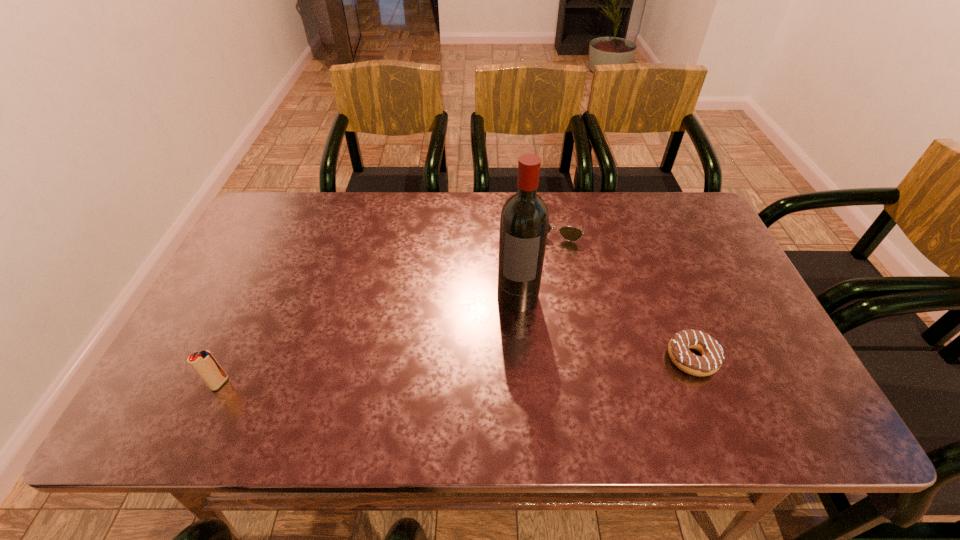
Identify the location of free space that satisfies the following two spatial constraints: 1. on the back side of the third shortest object; 2. on the left side of the tallest object. (260, 296).